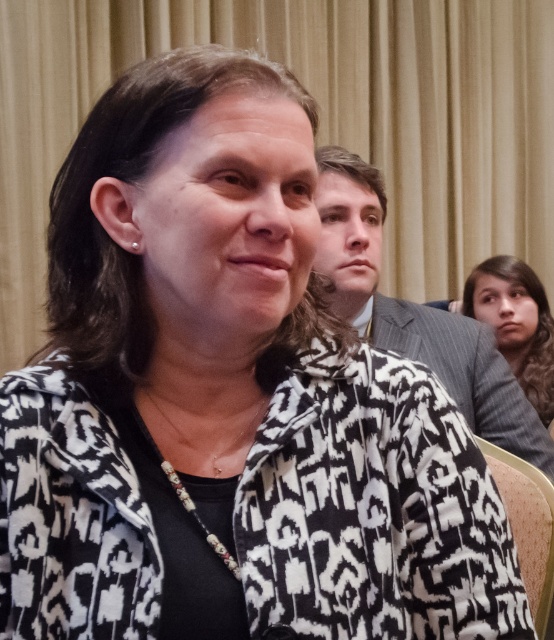
Does gray wool sweater at lower right have a lesser width compared to beige fabric chair at lower right?

Incorrect, gray wool sweater at lower right's width is not less than beige fabric chair at lower right's.

Which is in front, point (525, 358) or point (534, 467)?

Point (534, 467) is more forward.

You are a GUI agent. You are given a task and a screenshot of the screen. Output one action in this format:
    pyautogui.click(x=<x>, y=<y>)
    Task: Click on the gray wool sweater at lower right
    The height and width of the screenshot is (640, 554).
    Given the screenshot: What is the action you would take?
    pyautogui.click(x=516, y=323)

Is gray suit jacket at upper center taller than gray wool sweater at lower right?

Indeed, gray suit jacket at upper center has a greater height compared to gray wool sweater at lower right.

Which is behind, point (519, 451) or point (466, 291)?

The point (466, 291) is more distant.

Locate an element on the screen. This screenshot has height=640, width=554. gray suit jacket at upper center is located at coordinates (416, 312).

Who is lower down, black and white patterned jacket at center or beige fabric chair at lower right?

beige fabric chair at lower right is lower down.

Could you measure the distance between black and white patterned jacket at center and beige fabric chair at lower right?

black and white patterned jacket at center and beige fabric chair at lower right are 26.75 inches apart from each other.

At what (x,y) coordinates should I click in order to perform the action: click on black and white patterned jacket at center. Please return your answer as a coordinate pair (x, y). This screenshot has height=640, width=554. Looking at the image, I should click on (372, 509).